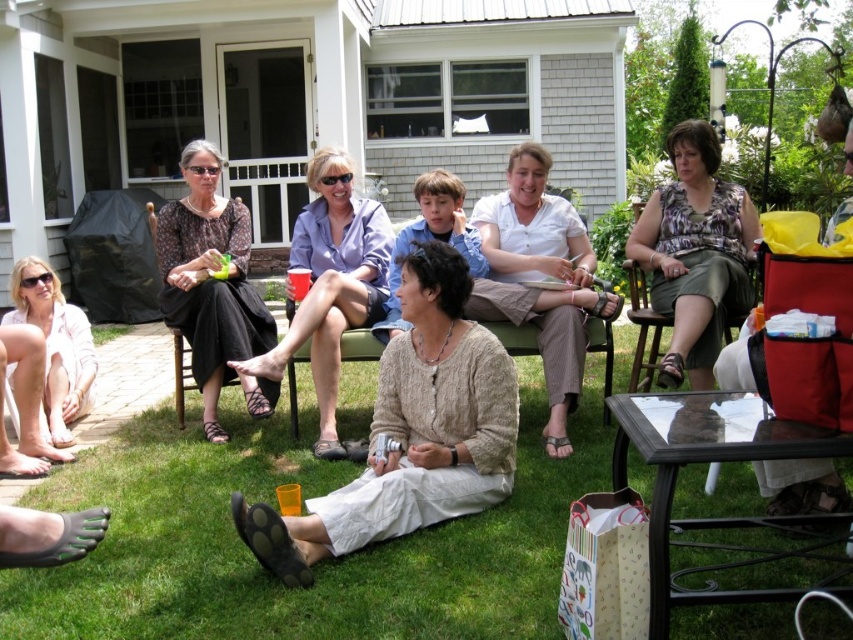
You are a photographer standing in the backyard scene. You notice the pink cotton shirt at lower left and the green matte cup at center. Which object is positioned lower in the image?

The pink cotton shirt at lower left is positioned below the green matte cup at center, so it is lower in the image.

You are organizing a clothing swap event and have two items to display side by side on a table. The items are the printed cotton blouse at center and the white cotton shirt at center. Based on their sizes, which one should you place on the left to ensure both items are visible without overlapping?

Since the printed cotton blouse at center is smaller than the white cotton shirt at center, you should place the printed cotton blouse at center on the left and the white cotton shirt at center on the right. This arrangement ensures the smaller item is visible next to the larger one without overlapping.